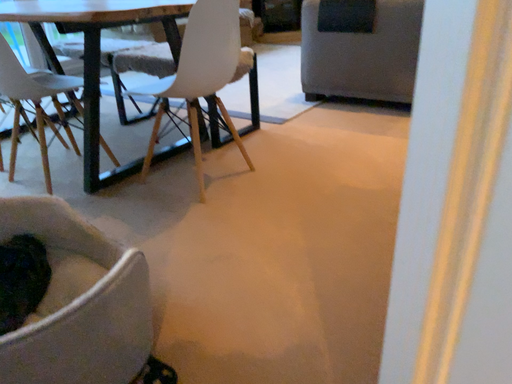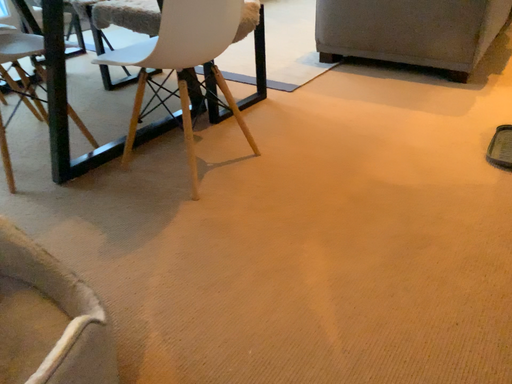
Question: Which way did the camera rotate in the video?

Choices:
 (A) rotated downward
 (B) rotated upward

Answer: (A)